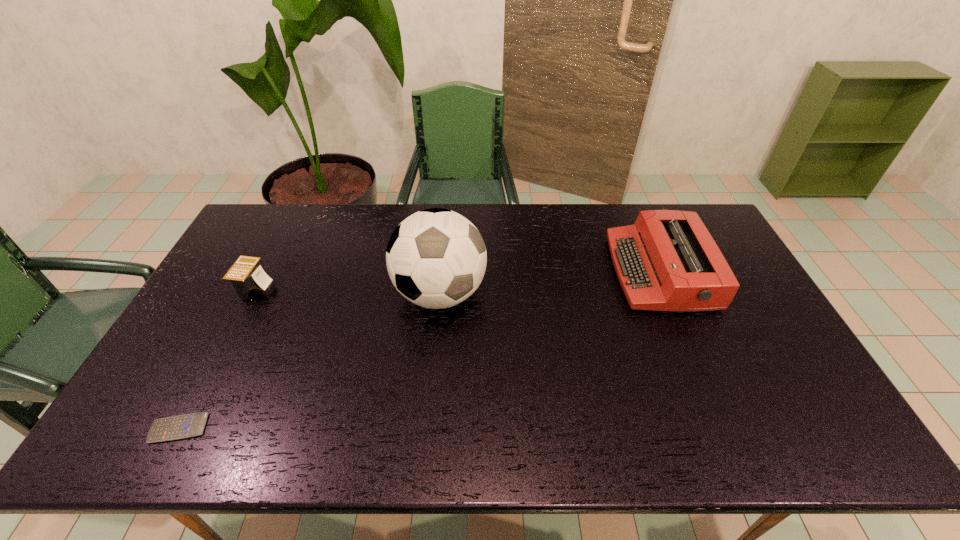
Where is `free spot between the farther calculator and the nearest object`? The image size is (960, 540). free spot between the farther calculator and the nearest object is located at coordinates (218, 359).

Locate an element on the screen. Image resolution: width=960 pixels, height=540 pixels. free spot between the third object from left to right and the farther calculator is located at coordinates (348, 292).

This screenshot has height=540, width=960. Find the location of `vacant area that lies between the soccer ball and the farther calculator`. vacant area that lies between the soccer ball and the farther calculator is located at coordinates (348, 292).

Find the location of a particular element. Image resolution: width=960 pixels, height=540 pixels. free space between the shorter calculator and the farther calculator is located at coordinates (218, 359).

I want to click on object that is the second closest to the third tallest object, so click(436, 258).

Locate which object ranks second in proximity to the shortest object. Please provide its 2D coordinates. Your answer should be formatted as a tuple, i.e. [(x, y)], where the tuple contains the x and y coordinates of a point satisfying the conditions above.

[(436, 258)]

Where is `free location that satisfies the following two spatial constraints: 1. on the typing side of the typewriter; 2. on the front side of the shortest object`? free location that satisfies the following two spatial constraints: 1. on the typing side of the typewriter; 2. on the front side of the shortest object is located at coordinates (725, 428).

You are a GUI agent. You are given a task and a screenshot of the screen. Output one action in this format:
    pyautogui.click(x=<x>, y=<y>)
    Task: Click on the free space that satisfies the following two spatial constraints: 1. on the typing side of the rightmost object; 2. on the front side of the second shortest object
    
    Given the screenshot: What is the action you would take?
    pyautogui.click(x=666, y=289)

At what (x,y) coordinates should I click in order to perform the action: click on vacant area that satisfies the following two spatial constraints: 1. on the typing side of the rightmost object; 2. on the front side of the farther calculator. Please return your answer as a coordinate pair (x, y). Image resolution: width=960 pixels, height=540 pixels. Looking at the image, I should click on (666, 289).

At what (x,y) coordinates should I click in order to perform the action: click on free point that satisfies the following two spatial constraints: 1. on the typing side of the typewriter; 2. on the main logo of the soccer ball. Please return your answer as a coordinate pair (x, y). This screenshot has height=540, width=960. Looking at the image, I should click on (668, 293).